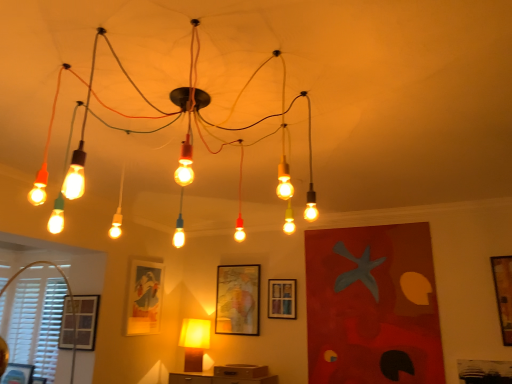
Question: Considering the positions of white plastic blinds at lower left and matte glass picture frame at center left, arranged as the third picture frame when viewed from the left, in the image, is white plastic blinds at lower left bigger or smaller than matte glass picture frame at center left, arranged as the third picture frame when viewed from the left,?

Choices:
 (A) small
 (B) big

Answer: (B)

Question: In terms of width, does white plastic blinds at lower left look wider or thinner when compared to matte glass picture frame at center left, arranged as the third picture frame when viewed from the left?

Choices:
 (A) thin
 (B) wide

Answer: (B)

Question: Which object is the closest to the white plastic blinds at lower left?

Choices:
 (A) matte glass light fixture at center, which is the second lamp in back-to-front order
 (B) wooden framed map at center, marked as the 3th picture frame in a right-to-left arrangement
 (C) wooden picture frame at center, the fifth picture frame when ordered from left to right
 (D) wooden picture frame at lower left, which is counted as the first picture frame, starting from the left
 (E) matte black picture frame at lower left, placed as the 2th picture frame when sorted from left to right

Answer: (E)

Question: Estimate the real-world distances between objects in this image. Which object is farther from the matte glass light fixture at center, the first lamp when ordered from top to bottom?

Choices:
 (A) wooden picture frame at right, which is counted as the sixth picture frame, starting from the left
 (B) matte glass picture frame at center left, which appears as the fourth picture frame when viewed from the right
 (C) matte black picture frame at lower left, the 5th picture frame positioned from the right
 (D) white plastic blinds at lower left
 (E) wooden framed map at center, marked as the 3th picture frame in a right-to-left arrangement

Answer: (A)